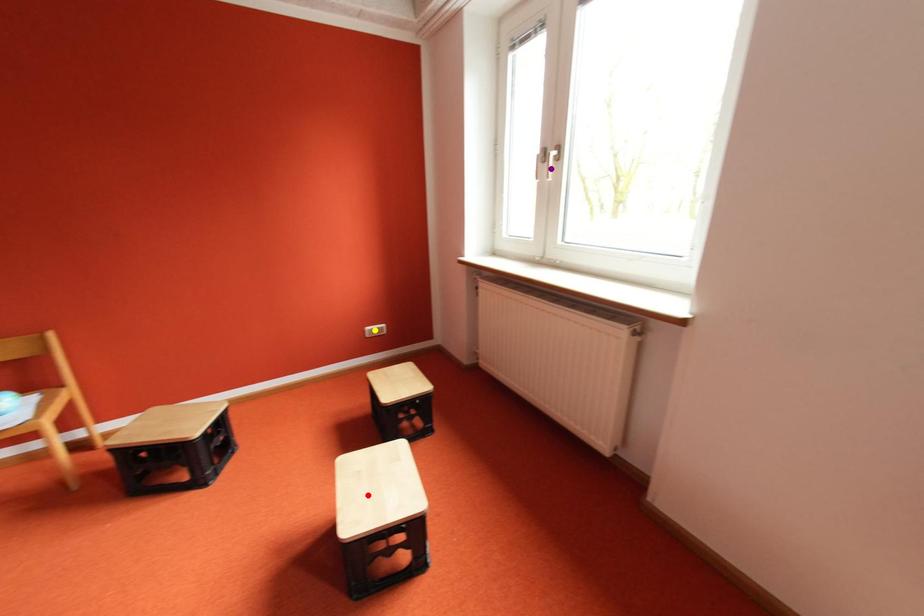
Order these from nearest to farthest:
red point, yellow point, purple point

1. yellow point
2. purple point
3. red point